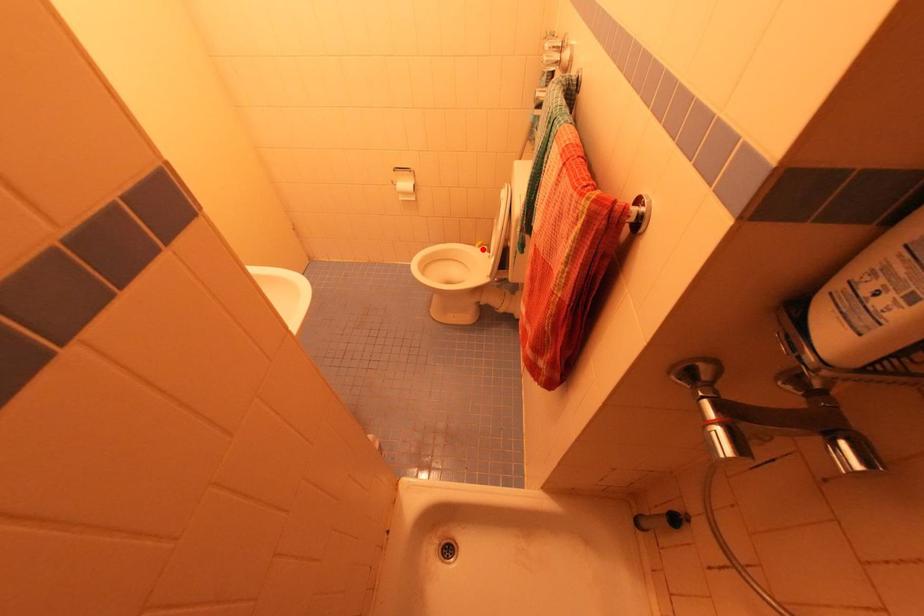
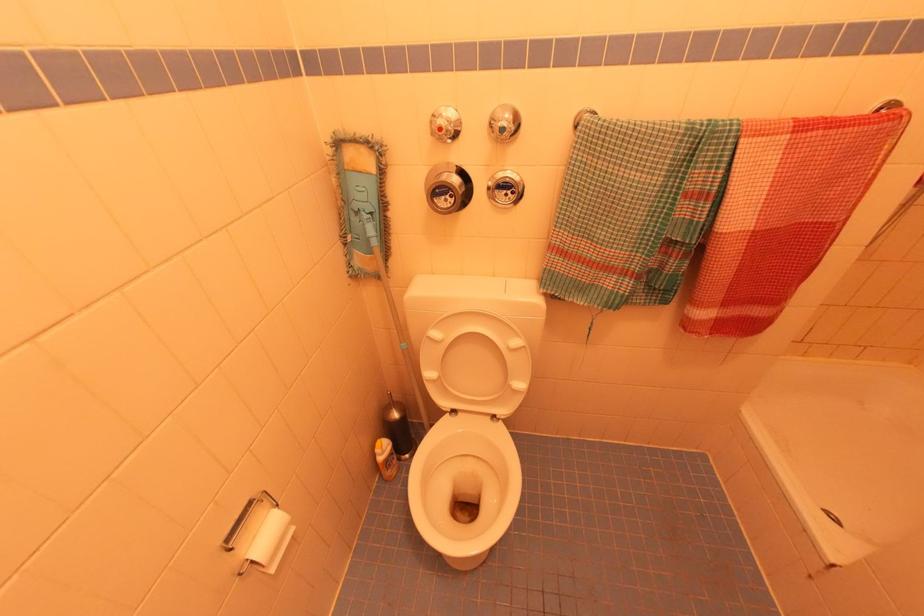
Find the pixel in the second image that matches the highlighted location in the first image.

(385, 448)